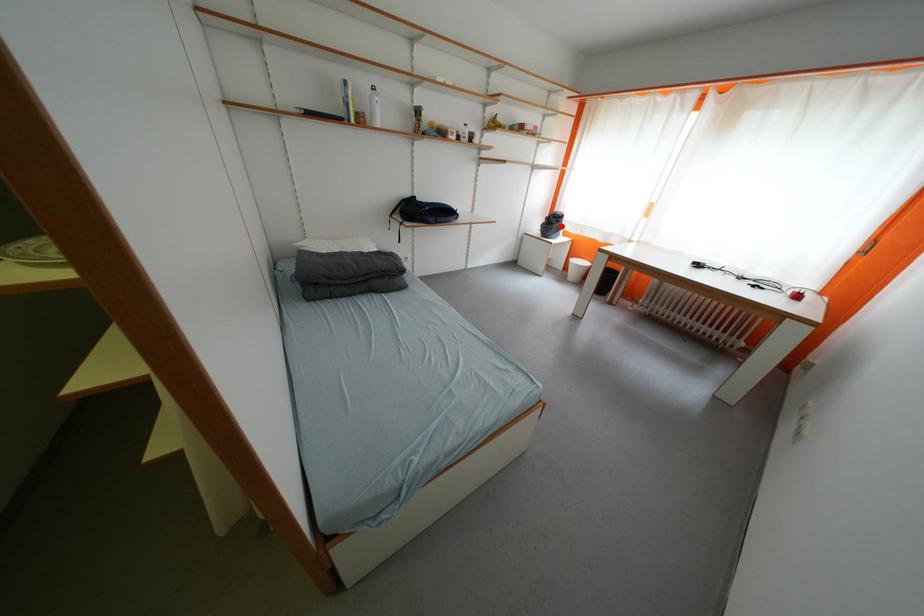
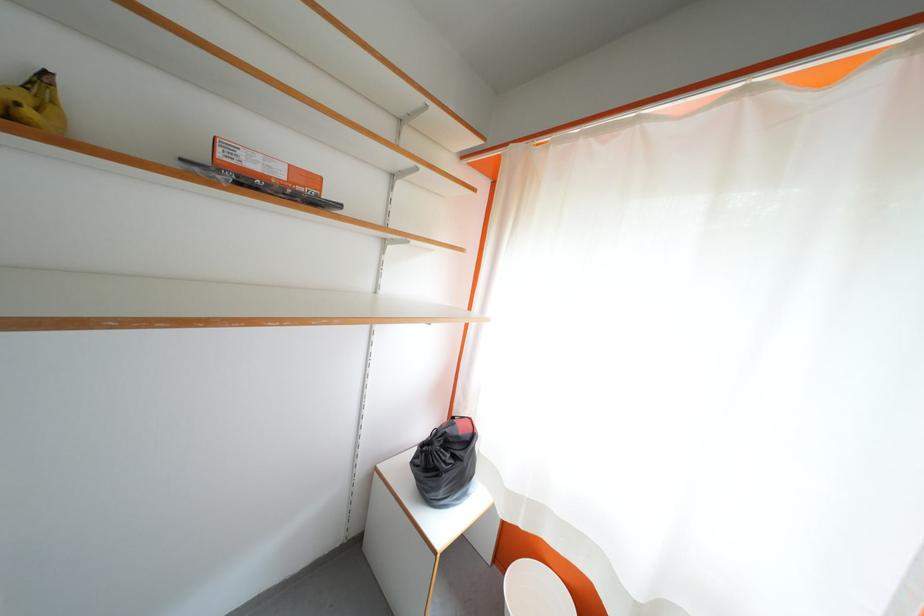
Question: I am providing you with two images of the same scene from different viewpoints. Image1 has a red point marked. In image2, the corresponding 3D location appears at what relative position? Reply with the corresponding letter.

Choices:
 (A) Closer
 (B) Farther

Answer: (B)